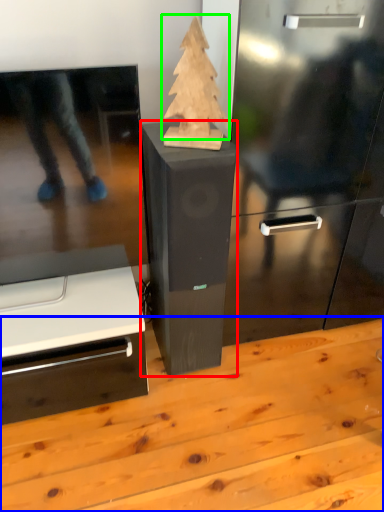
Question: Which object is positioned closest to furniture (highlighted by a red box)? Select from table (highlighted by a blue box) and christmas tree (highlighted by a green box).

Choices:
 (A) table
 (B) christmas tree

Answer: (B)